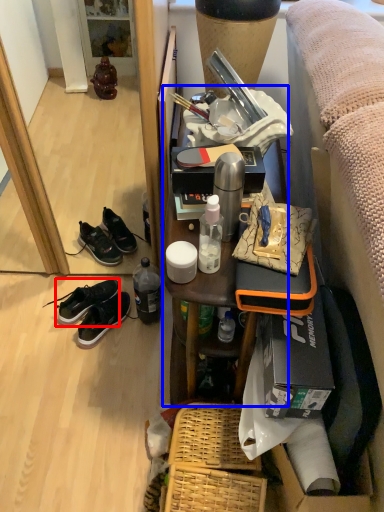
Question: Which of the following is the closest to the observer, shoe (highlighted by a red box) or furniture (highlighted by a blue box)?

Choices:
 (A) shoe
 (B) furniture

Answer: (B)